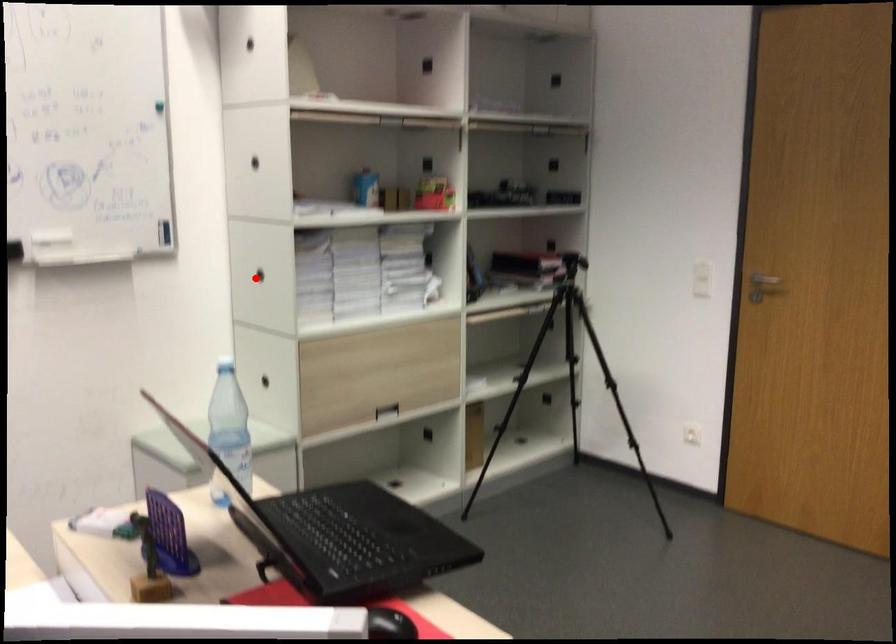
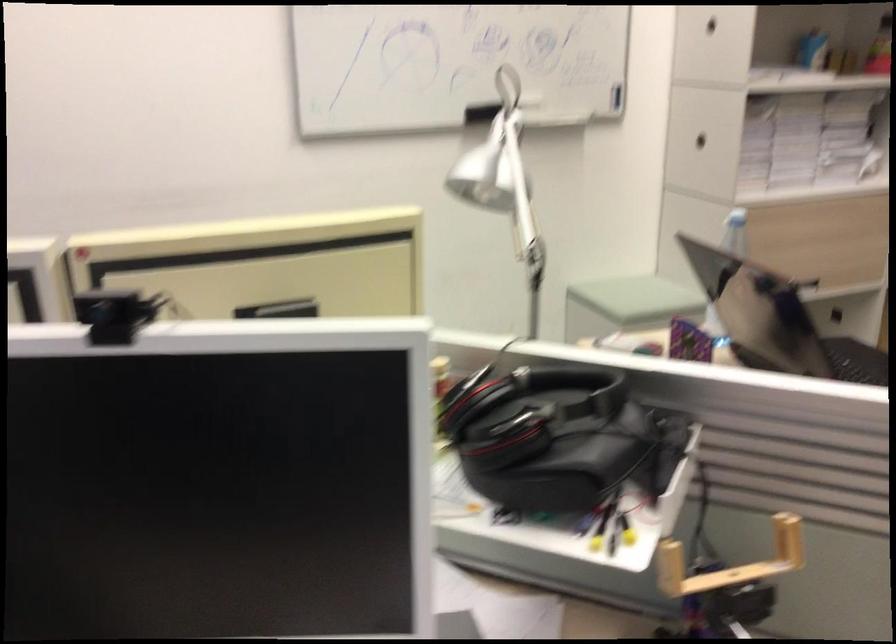
Find the pixel in the second image that matches the highlighted location in the first image.

(700, 140)